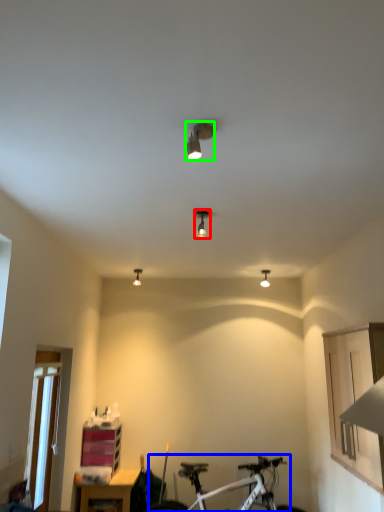
Question: Which is nearer to the light fixture (highlighted by a red box)? bicycle (highlighted by a blue box) or light fixture (highlighted by a green box).

Choices:
 (A) bicycle
 (B) light fixture

Answer: (B)